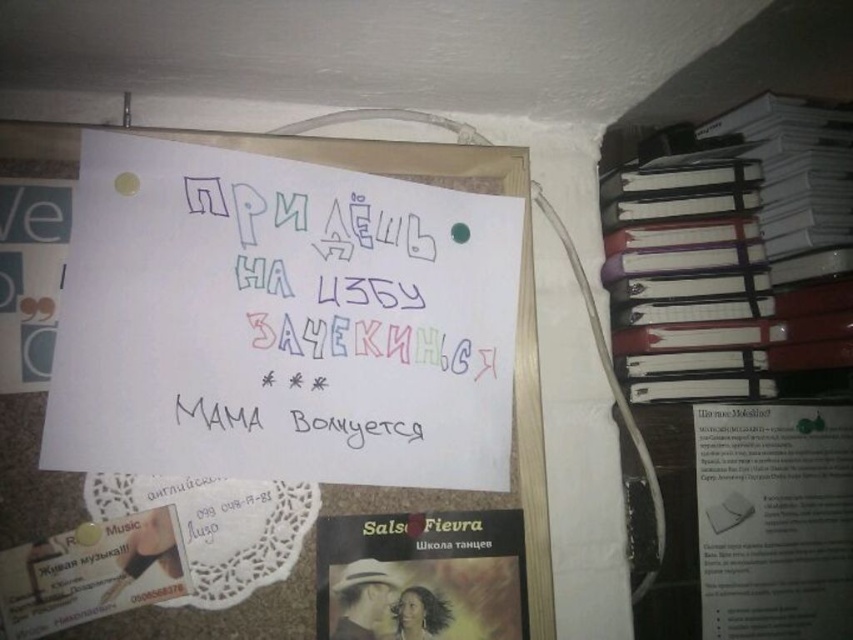
This screenshot has height=640, width=853. What are the coordinates of `colored paper note at center` in the screenshot? It's located at (343, 308).

Is point (234, 244) positioned in front of point (523, 252)?

Yes.

Is point (428, 406) less distant than point (265, 145)?

Yes, it is in front of point (265, 145).

Where is `colored paper note at center`? The image size is (853, 640). colored paper note at center is located at coordinates (343, 308).

The height and width of the screenshot is (640, 853). What do you see at coordinates (735, 257) in the screenshot? I see `white paper at right` at bounding box center [735, 257].

Does point (686, 320) come farther from viewer compared to point (534, 538)?

Yes, it is behind point (534, 538).

I want to click on white paper at right, so click(x=735, y=257).

Consider the image. Can you confirm if colored paper note at center is bigger than matte black book at center?

Indeed, colored paper note at center has a larger size compared to matte black book at center.

Which is more to the left, colored paper note at center or matte black book at center?

From the viewer's perspective, colored paper note at center appears more on the left side.

Where is `colored paper note at center`? colored paper note at center is located at coordinates (343, 308).